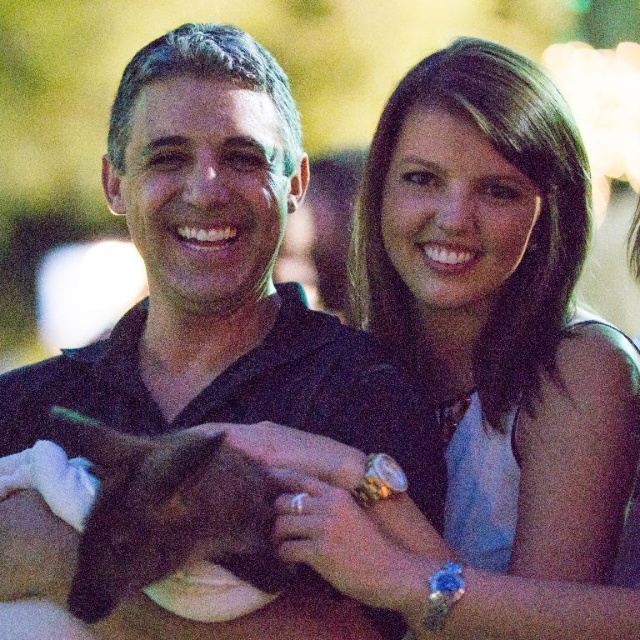
Based on the scene described, which object is taller between the black matte shirt at center and the satin white dress at upper right?

The black matte shirt at center is much taller than the satin white dress at upper right.

You are a photographer at a social event and need to adjust your camera focus. The black matte shirt at center and the satin white dress at upper right are both in the frame. Which object is positioned higher in the image?

The black matte shirt at center is above the satin white dress at upper right, so it is positioned higher in the image.